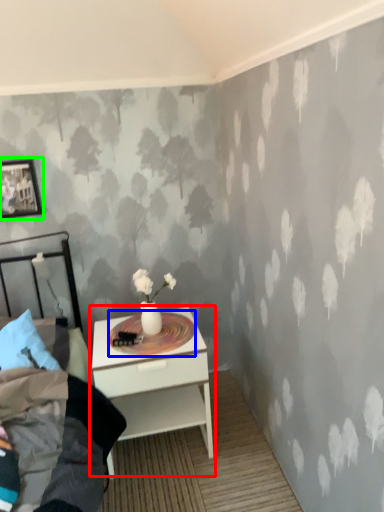
Question: Which object is the farthest from nightstand (highlighted by a red box)? Choose among these: round table (highlighted by a blue box) or picture frame (highlighted by a green box).

Choices:
 (A) round table
 (B) picture frame

Answer: (B)